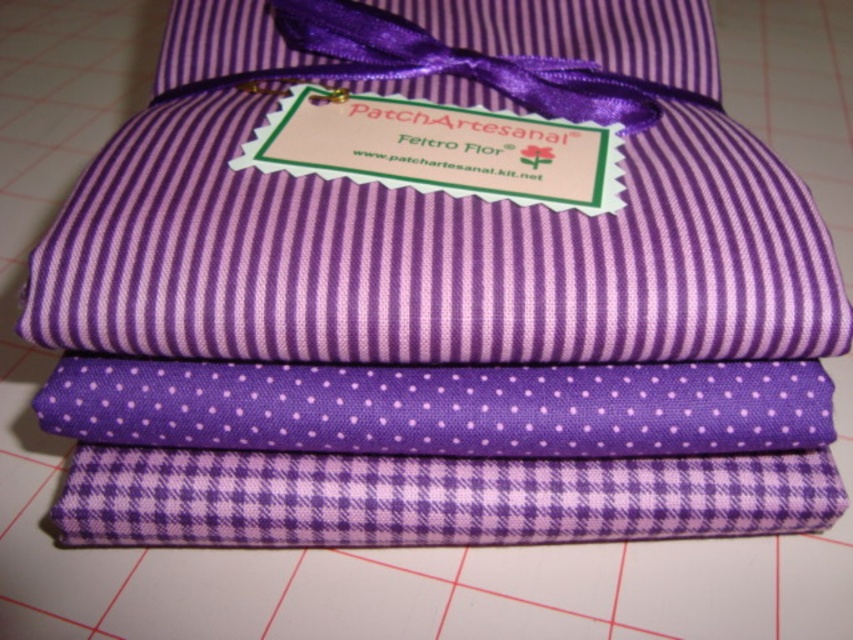
Question: Is matte purple fabric at center smaller than purple dotted fabric at center?

Choices:
 (A) no
 (B) yes

Answer: (A)

Question: Among these points, which one is farthest from the camera?

Choices:
 (A) (827, 483)
 (B) (675, 396)
 (C) (263, 300)

Answer: (A)

Question: Does purple dotted fabric at center have a smaller size compared to purple checkered fabric at bottom?

Choices:
 (A) yes
 (B) no

Answer: (A)

Question: Among these objects, which one is nearest to the camera?

Choices:
 (A) purple checkered fabric at bottom
 (B) purple dotted fabric at center

Answer: (B)

Question: Which point is closer to the camera?

Choices:
 (A) purple dotted fabric at center
 (B) purple checkered fabric at bottom
 (C) matte purple fabric at center

Answer: (C)

Question: Can you confirm if matte purple fabric at center is positioned above purple checkered fabric at bottom?

Choices:
 (A) no
 (B) yes

Answer: (B)